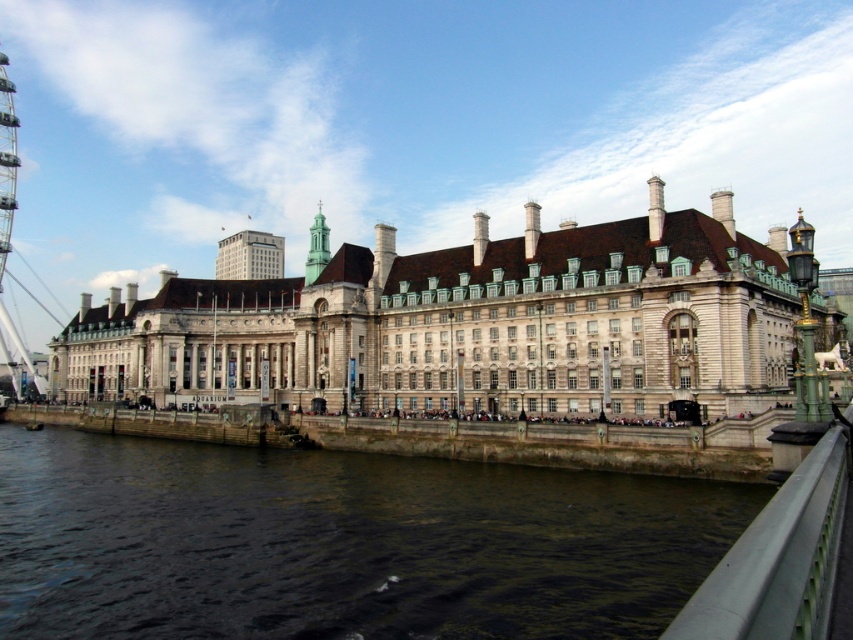
Is dark brown water at lower center above green stone tower at center?

Actually, dark brown water at lower center is below green stone tower at center.

Who is more distant from viewer, (306, 522) or (315, 253)?

Positioned behind is point (315, 253).

Describe the element at coordinates (341, 544) in the screenshot. This screenshot has width=853, height=640. I see `dark brown water at lower center` at that location.

This screenshot has height=640, width=853. In order to click on dark brown water at lower center in this screenshot , I will do `click(341, 544)`.

Image resolution: width=853 pixels, height=640 pixels. What do you see at coordinates (779, 560) in the screenshot?
I see `green metallic railing at lower right` at bounding box center [779, 560].

Which of these two, green metallic railing at lower right or metallic ferris wheel at left, stands shorter?

Standing shorter between the two is green metallic railing at lower right.

Which is in front, point (772, 584) or point (0, 154)?

Point (772, 584) is more forward.

Identify the location of green metallic railing at lower right. This screenshot has height=640, width=853. (779, 560).

Is white stone building at center smaller than metallic ferris wheel at left?

No, white stone building at center is not smaller than metallic ferris wheel at left.

Is white stone building at center positioned behind metallic ferris wheel at left?

No, it is in front of metallic ferris wheel at left.

Describe the element at coordinates (463, 324) in the screenshot. I see `white stone building at center` at that location.

At what (x,y) coordinates should I click in order to perform the action: click on white stone building at center. Please return your answer as a coordinate pair (x, y). Looking at the image, I should click on click(x=463, y=324).